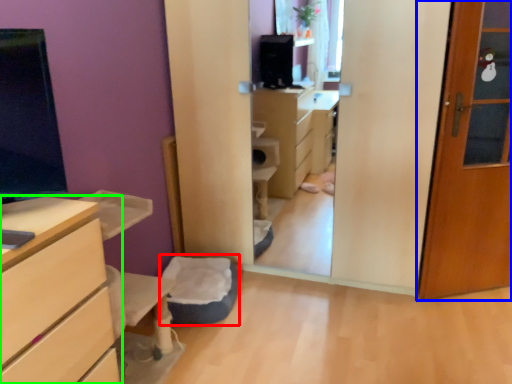
Question: Considering the real-world distances, which object is closest to flat (highlighted by a red box)? door (highlighted by a blue box) or chest of drawers (highlighted by a green box).

Choices:
 (A) door
 (B) chest of drawers

Answer: (B)